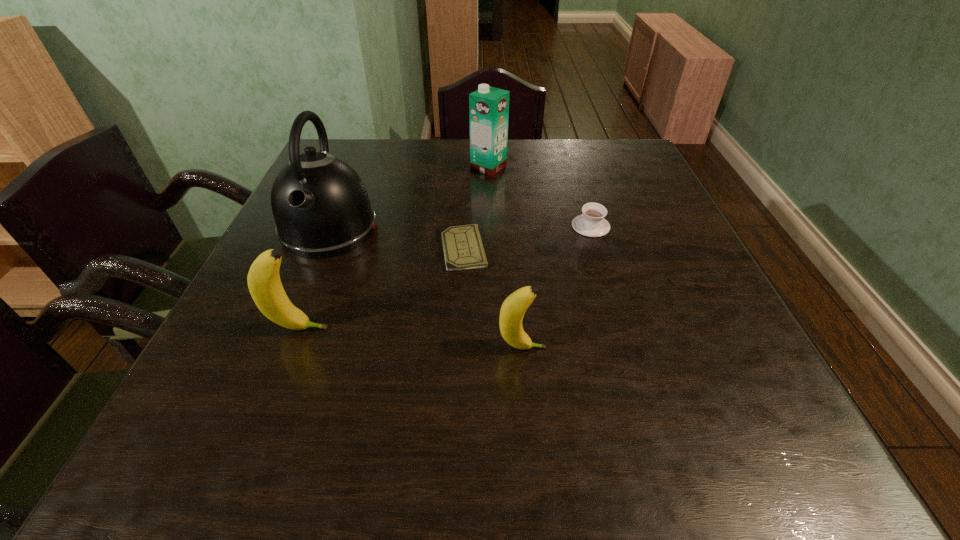
Identify the location of vacant space situated 0.230m from the stem of the left banana. (453, 329).

At what (x,y) coordinates should I click in order to perform the action: click on blank space located 0.230m from the stem of the right banana. Please return your answer as a coordinate pair (x, y). The image size is (960, 540). Looking at the image, I should click on (676, 348).

Identify the location of free space located on the right of the fifth shortest object. (545, 167).

Where is `free location located 0.180m on the handle side of the teacup`? free location located 0.180m on the handle side of the teacup is located at coordinates (576, 178).

The image size is (960, 540). What are the coordinates of `free space located on the handle side of the teacup` in the screenshot? It's located at (578, 185).

At what (x,y) coordinates should I click in order to perform the action: click on vacant space located 0.380m on the handle side of the teacup. Please return your answer as a coordinate pair (x, y). Image resolution: width=960 pixels, height=540 pixels. Looking at the image, I should click on (565, 144).

The height and width of the screenshot is (540, 960). What are the coordinates of `free space located 0.160m on the spout of the tallest object` in the screenshot? It's located at (291, 320).

Where is `free region located on the front of the shortest object`? free region located on the front of the shortest object is located at coordinates (461, 292).

The image size is (960, 540). What are the coordinates of `object located at the far edge` in the screenshot? It's located at (488, 107).

Identify the location of banana that is at the left edge. (264, 283).